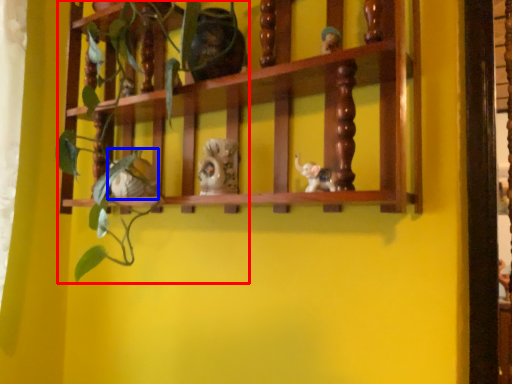
Question: Which object appears farthest to the camera in this image, plant (highlighted by a red box) or toy (highlighted by a blue box)?

Choices:
 (A) plant
 (B) toy

Answer: (B)